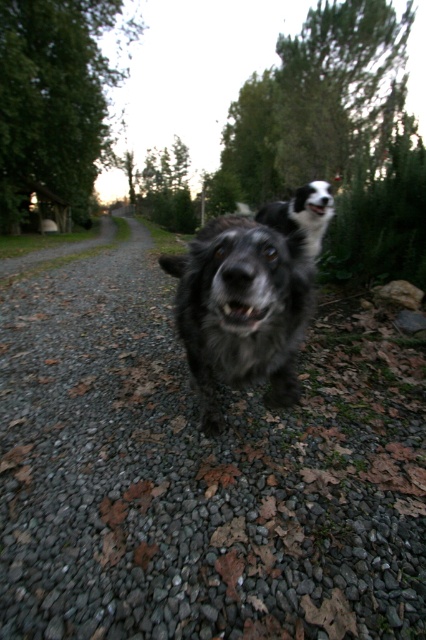
Can you confirm if fuzzy black dog at center is positioned to the right of black fur dog at center?

In fact, fuzzy black dog at center is to the left of black fur dog at center.

Between point (230, 285) and point (321, 240), which one is positioned in front?

Point (230, 285) is in front.

I want to click on fuzzy black dog at center, so click(x=241, y=308).

Looking at this image, is gray gravel at center positioned in front of black fur dog at center?

Yes, it is.

Is gray gravel at center smaller than black fur dog at center?

Yes, gray gravel at center is smaller than black fur dog at center.

Which is in front, point (124, 291) or point (302, 216)?

Point (302, 216) is in front.

In order to click on gray gravel at center in this screenshot , I will do `click(199, 472)`.

The image size is (426, 640). What do you see at coordinates (199, 472) in the screenshot? I see `gray gravel at center` at bounding box center [199, 472].

Where is `gray gravel at center`? The image size is (426, 640). gray gravel at center is located at coordinates (199, 472).